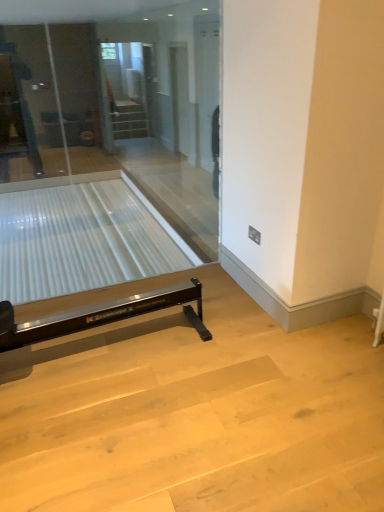
Question: Is transparent glass door at center surrounded by clear glass table at lower left?

Choices:
 (A) yes
 (B) no

Answer: (B)

Question: Does clear glass table at lower left appear on the right side of transparent glass door at center?

Choices:
 (A) no
 (B) yes

Answer: (A)

Question: Considering the relative sizes of clear glass table at lower left and transparent glass door at center in the image provided, is clear glass table at lower left shorter than transparent glass door at center?

Choices:
 (A) yes
 (B) no

Answer: (A)

Question: Is clear glass table at lower left taller than transparent glass door at center?

Choices:
 (A) yes
 (B) no

Answer: (B)

Question: From the image's perspective, is clear glass table at lower left over transparent glass door at center?

Choices:
 (A) no
 (B) yes

Answer: (A)

Question: Is clear glass table at lower left in front of transparent glass door at center?

Choices:
 (A) yes
 (B) no

Answer: (B)

Question: From a real-world perspective, is transparent glass door at center below clear glass screen door at upper center?

Choices:
 (A) yes
 (B) no

Answer: (B)

Question: Is transparent glass door at center positioned in front of clear glass screen door at upper center?

Choices:
 (A) yes
 (B) no

Answer: (A)

Question: From the image's perspective, is transparent glass door at center below clear glass screen door at upper center?

Choices:
 (A) yes
 (B) no

Answer: (A)

Question: From a real-world perspective, does transparent glass door at center stand above clear glass screen door at upper center?

Choices:
 (A) yes
 (B) no

Answer: (A)

Question: Is transparent glass door at center facing away from clear glass screen door at upper center?

Choices:
 (A) no
 (B) yes

Answer: (B)

Question: Is clear glass screen door at upper center a part of transparent glass door at center?

Choices:
 (A) no
 (B) yes

Answer: (A)

Question: Is clear glass screen door at upper center directly adjacent to clear glass table at lower left?

Choices:
 (A) yes
 (B) no

Answer: (B)